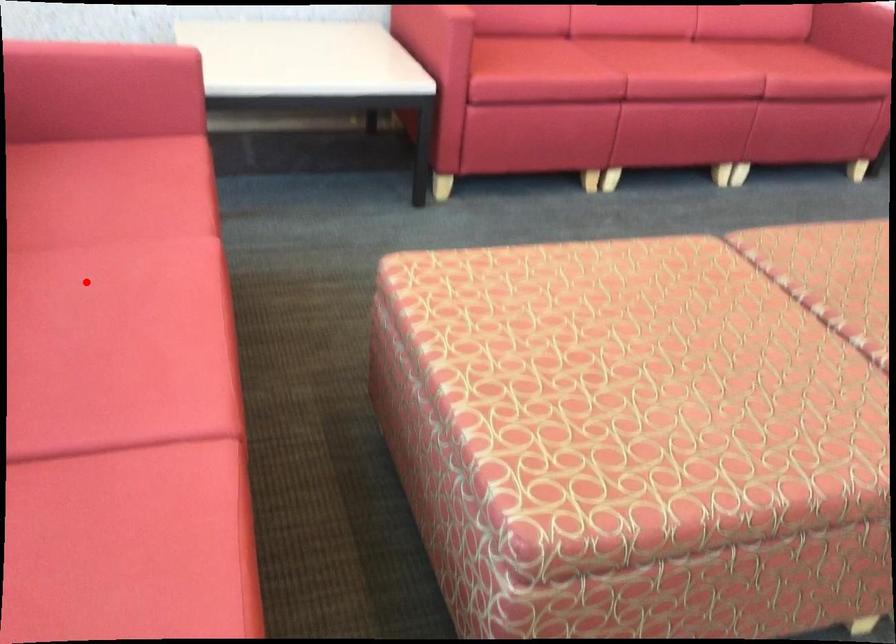
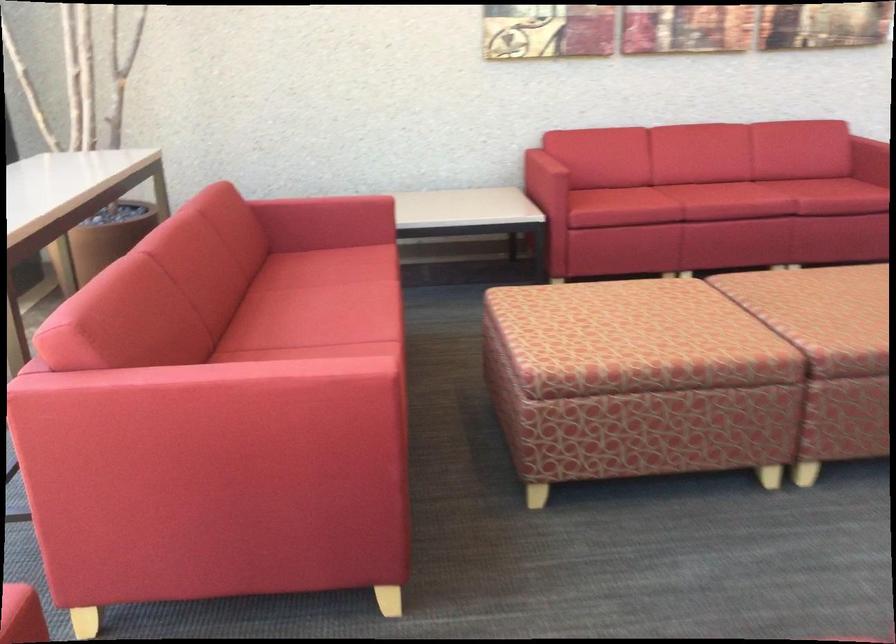
Question: I am providing you with two images of the same scene from different viewpoints. A red point is shown in image1. For the corresponding object point in image2, is it positioned nearer or farther from the camera?

Choices:
 (A) Nearer
 (B) Farther

Answer: (B)